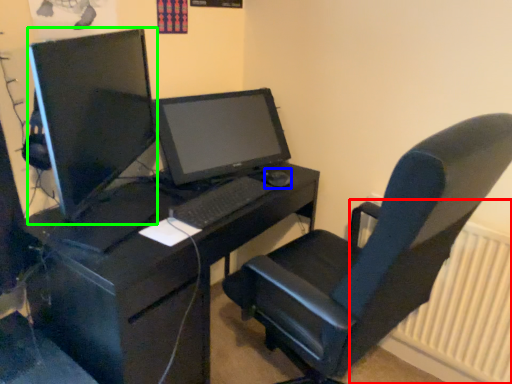
Question: Considering the real-world distances, which object is closest to radiator (highlighted by a red box)? mouse (highlighted by a blue box) or computer monitor (highlighted by a green box).

Choices:
 (A) mouse
 (B) computer monitor

Answer: (A)